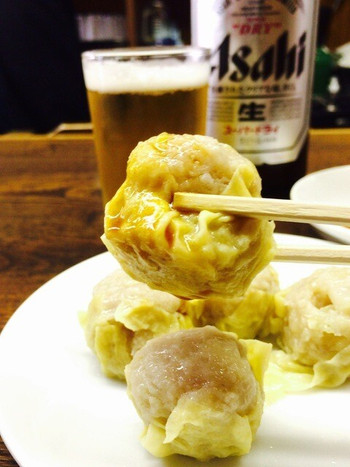
Locate an element on the screen. plates is located at coordinates (98, 425), (337, 191).